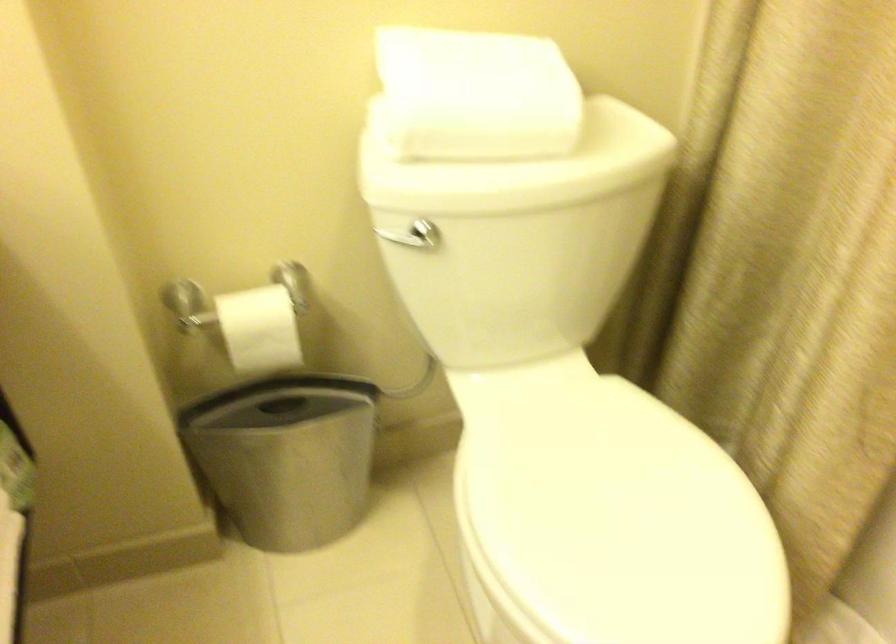
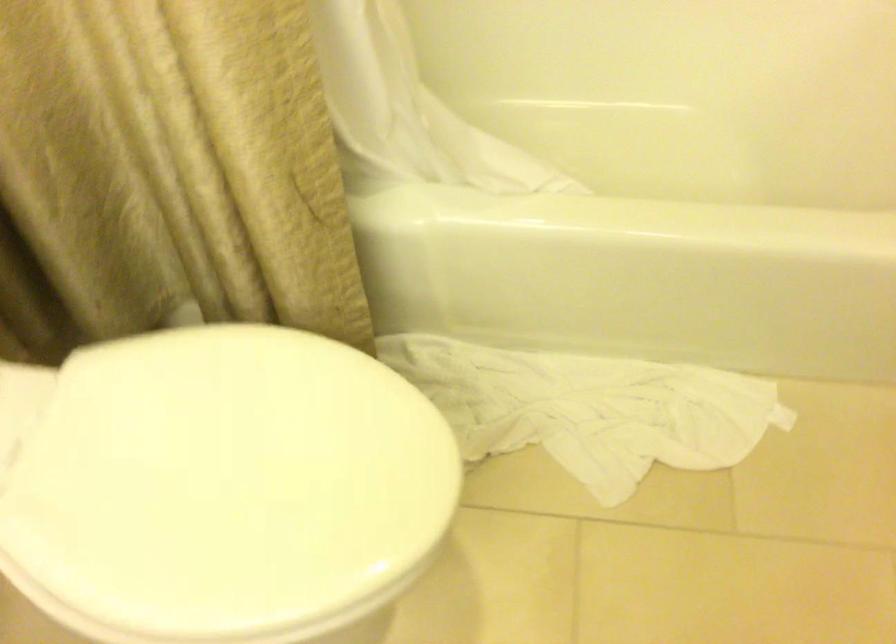
Find the pixel in the second image that matches point (596, 518) in the first image.

(219, 484)